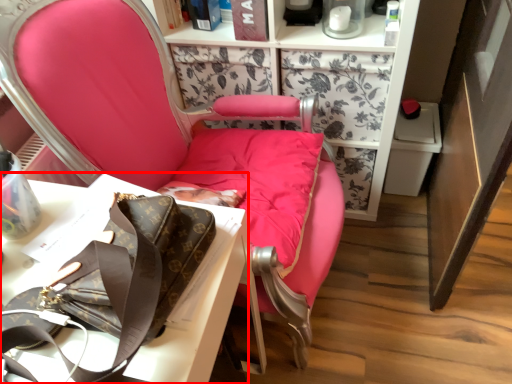
Question: Considering the relative positions of desk (annotated by the red box) and chair in the image provided, where is desk (annotated by the red box) located with respect to the staircase?

Choices:
 (A) left
 (B) right

Answer: (A)